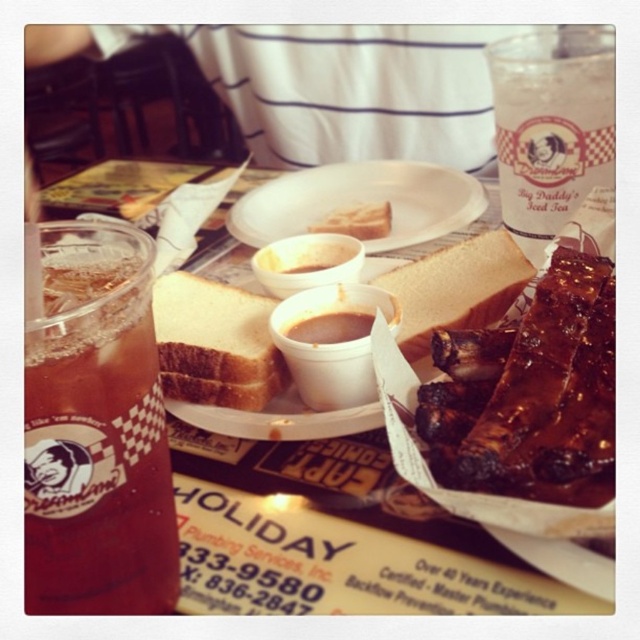
You are a customer at the barbecue restaurant and want to reach the white paper plate at center. If your hand can extend 25 centimeters, will you be able to reach it?

The white paper plate at center is 25.49 centimeters away from the viewer, so your hand can only extend 25 centimeters, meaning you cannot quite reach it. You would need to move closer or use a utensil to get it.

Consider the image. You are a server at the barbecue restaurant and need to place a 5 inch long utensil between the white paper plate at center and the brown matte bread at center. Is there enough space?

The distance between the white paper plate at center and the brown matte bread at center is 4.61 inches, which is less than the length of the utensil. Therefore, there is not enough space to place the 5 inch long utensil between them.

You are a food delivery person who needs to place a hot dish on the table. The plate is already holding food. Can you safely place the dish on the table without moving the existing items? Please consider the space between the white matte plate at center and the white matte bread at center.

The distance between the white matte plate at center and the white matte bread at center is 6.27 inches. Since the plate already has food, placing another dish might require at least 6.27 inches of space to avoid contact. However, without knowing the dish size, it is hard to confirm. But the existing space is 6.27 inches.